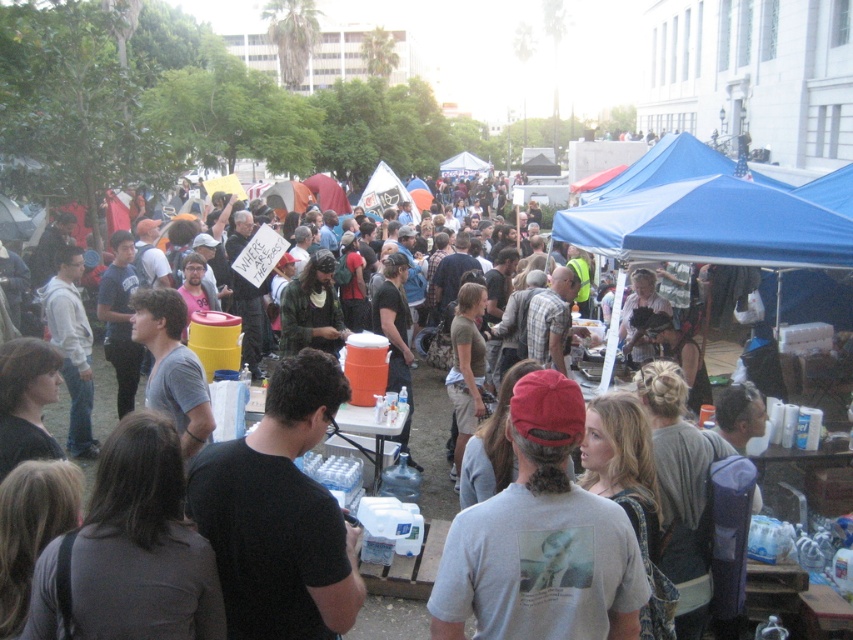
Question: Does gray cotton t-shirt at center have a lesser width compared to blue fabric canopy at center-right?

Choices:
 (A) no
 (B) yes

Answer: (B)

Question: Estimate the real-world distances between objects in this image. Which object is closer to the gray cotton t-shirt at center?

Choices:
 (A) blue fabric canopy at upper center
 (B) blue fabric canopy at center-right

Answer: (B)

Question: Considering the relative positions of gray cotton t-shirt at center and blue fabric canopy at upper center in the image provided, where is gray cotton t-shirt at center located with respect to blue fabric canopy at upper center?

Choices:
 (A) above
 (B) below

Answer: (B)

Question: Which point appears farthest from the camera in this image?

Choices:
 (A) (430, 628)
 (B) (575, 208)
 (C) (693, 157)

Answer: (C)

Question: Among these objects, which one is farthest from the camera?

Choices:
 (A) gray cotton t-shirt at center
 (B) blue fabric canopy at center-right
 (C) blue fabric canopy at upper center

Answer: (C)

Question: Is blue fabric canopy at center-right wider than blue fabric canopy at upper center?

Choices:
 (A) no
 (B) yes

Answer: (A)